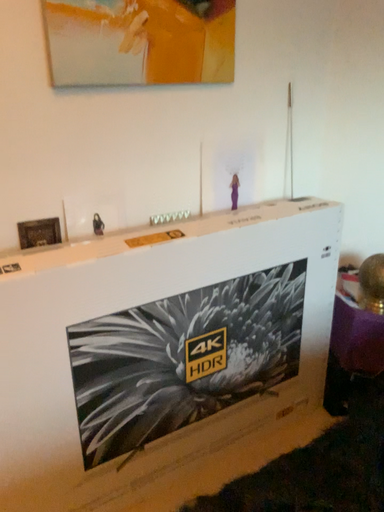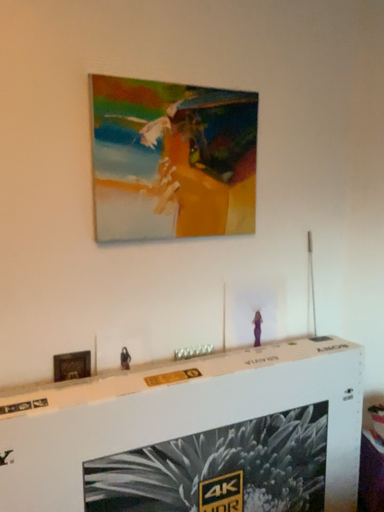
Question: Which way did the camera rotate in the video?

Choices:
 (A) rotated left
 (B) rotated right

Answer: (A)